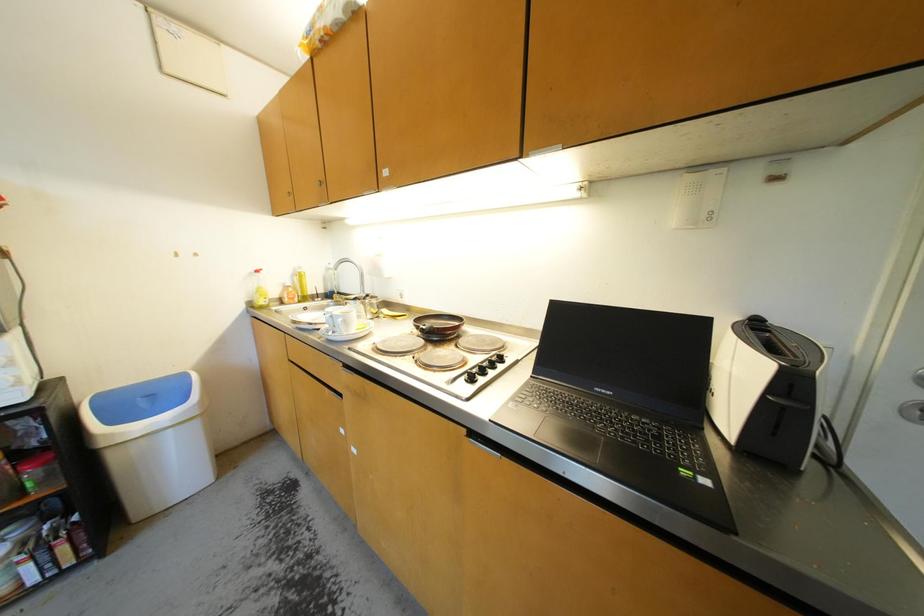
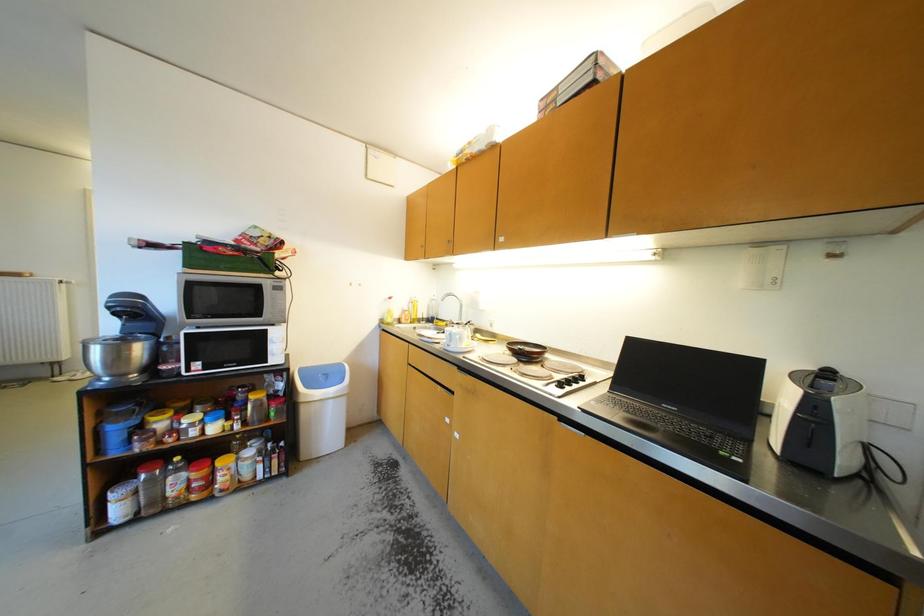
Question: Which direction would the cameraman need to move to produce the second image? Reply with the corresponding letter.

Choices:
 (A) Left
 (B) Right
 (C) Forward
 (D) Backward

Answer: (D)